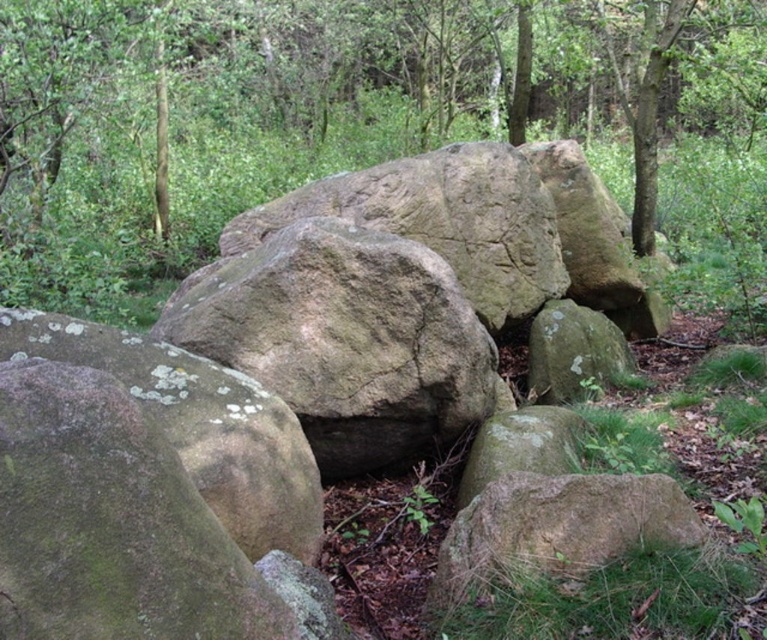
Question: Does smooth gray rock at center appear under green mossy rock at lower right?

Choices:
 (A) no
 (B) yes

Answer: (A)

Question: From the image, what is the correct spatial relationship of smooth beige rock at center in relation to green mossy rock at center?

Choices:
 (A) below
 (B) above

Answer: (B)

Question: Which of the following is the closest to the observer?

Choices:
 (A) (558, 428)
 (B) (259, 452)
 (C) (517, 188)
 (D) (565, 525)

Answer: (D)

Question: Which of the following is the closest to the observer?

Choices:
 (A) smooth beige rock at center
 (B) green mossy rock at lower left
 (C) green mossy rock at center
 (D) smooth gray rock at center

Answer: (B)

Question: Observing the image, what is the correct spatial positioning of green mossy rock at lower right in reference to green mossy rock at lower center?

Choices:
 (A) right
 (B) left

Answer: (B)

Question: Among these points, which one is nearest to the camera?

Choices:
 (A) (550, 456)
 (B) (387, 378)
 (C) (528, 531)

Answer: (C)